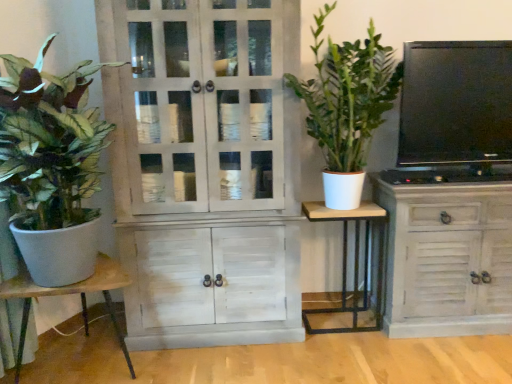
Locate an element on the screen. green matte plant at left, the 1th houseplant from the left is located at coordinates (51, 166).

The height and width of the screenshot is (384, 512). Describe the element at coordinates (354, 262) in the screenshot. I see `white wood table at center, arranged as the 2th table when viewed from the left` at that location.

Based on the photo, measure the distance between point [500,131] and camera.

Point [500,131] and camera are 2.28 meters apart.

At what (x,y) coordinates should I click in order to perform the action: click on distressed white cabinet at right, acting as the first cabinetry starting from the right. Please return your answer as a coordinate pair (x, y). The width and height of the screenshot is (512, 384). Looking at the image, I should click on (447, 251).

Find the location of a particular element. The image size is (512, 384). wooden table at left, which is counted as the 2th table, starting from the right is located at coordinates (70, 294).

Locate an element on the screen. white wood cabinet at center, which is counted as the 2th cabinetry, starting from the right is located at coordinates (205, 168).

Where is `green matte plant at left, the 1th houseplant from the left`? This screenshot has width=512, height=384. green matte plant at left, the 1th houseplant from the left is located at coordinates (51, 166).

How distant is matte black tv at upper right from green matte plant at left, positioned as the second houseplant in right-to-left order?

A distance of 1.69 meters exists between matte black tv at upper right and green matte plant at left, positioned as the second houseplant in right-to-left order.

Is there a large distance between matte black tv at upper right and green matte plant at left, the 1th houseplant from the left?

Yes, matte black tv at upper right is far from green matte plant at left, the 1th houseplant from the left.

From the picture: Can you tell me how much matte black tv at upper right and green matte plant at left, positioned as the second houseplant in right-to-left order, differ in facing direction?

They differ by 36.3 degrees in their facing directions.

In the scene shown: From a real-world perspective, is matte black tv at upper right beneath green matte plant at left, the 1th houseplant from the left?

Actually, matte black tv at upper right is physically above green matte plant at left, the 1th houseplant from the left, in the real world.

The height and width of the screenshot is (384, 512). There is a matte black tv at upper right. Find the location of `the 2nd table below it (from the image's perspective)`. the 2nd table below it (from the image's perspective) is located at coordinates (70, 294).

Is wooden table at left, which is the first table from left to right, outside of matte black tv at upper right?

That's correct, wooden table at left, which is the first table from left to right, is outside of matte black tv at upper right.

Could you tell me if wooden table at left, which is counted as the 2th table, starting from the right, is turned towards matte black tv at upper right?

No, wooden table at left, which is counted as the 2th table, starting from the right, is not oriented towards matte black tv at upper right.

Is the position of wooden table at left, which is the first table from left to right, more distant than that of matte black tv at upper right?

No.

Is point (27, 305) behind point (343, 131)?

No, it is not.

In the scene shown: Is wooden table at left, which is the first table from left to right, not within green matte plant at center, which is counted as the second houseplant, starting from the left?

Result: wooden table at left, which is the first table from left to right, lies outside green matte plant at center, which is counted as the second houseplant, starting from the left,'s area.

How different are the orientations of wooden table at left, which is the first table from left to right, and green matte plant at center, which is counted as the second houseplant, starting from the left, in degrees?

wooden table at left, which is the first table from left to right, and green matte plant at center, which is counted as the second houseplant, starting from the left, are facing 48.7 degrees away from each other.

Identify the location of table that appears in front of the green matte plant at center, which is counted as the second houseplant, starting from the left. Image resolution: width=512 pixels, height=384 pixels. (70, 294).

From the image's perspective, does white wood table at center, which is the 1th table in right-to-left order, appear higher than matte black tv at upper right?

No, from the image's perspective, white wood table at center, which is the 1th table in right-to-left order, is not on top of matte black tv at upper right.

Is white wood table at center, arranged as the 2th table when viewed from the left, positioned far away from matte black tv at upper right?

No, white wood table at center, arranged as the 2th table when viewed from the left, is not far from matte black tv at upper right.

Find the location of a particular element. television above the white wood table at center, arranged as the 2th table when viewed from the left (from the image's perspective) is located at coordinates (456, 102).

From a real-world perspective, is white wood table at center, arranged as the 2th table when viewed from the left, physically located above or below matte black tv at upper right?

white wood table at center, arranged as the 2th table when viewed from the left, is situated lower than matte black tv at upper right in the real world.

From a real-world perspective, which object stands above the other?

green matte plant at center, which is counted as the second houseplant, starting from the left, is physically above.

From the image's perspective, is green matte plant at center, positioned as the first houseplant in right-to-left order, over white wood cabinet at center, which is counted as the 2th cabinetry, starting from the right?

Yes, from the image's perspective, green matte plant at center, positioned as the first houseplant in right-to-left order, is over white wood cabinet at center, which is counted as the 2th cabinetry, starting from the right.

Which is behind, point (335, 69) or point (197, 250)?

The point (335, 69) is farther from the camera.

Would you say green matte plant at center, positioned as the first houseplant in right-to-left order, is outside white wood cabinet at center, which appears as the first cabinetry when viewed from the left?

Absolutely, green matte plant at center, positioned as the first houseplant in right-to-left order, is external to white wood cabinet at center, which appears as the first cabinetry when viewed from the left.

From the image's perspective, relative to white wood cabinet at center, which appears as the first cabinetry when viewed from the left, is distressed white cabinet at right, acting as the first cabinetry starting from the right, above or below?

From the image's perspective, distressed white cabinet at right, acting as the first cabinetry starting from the right, appears below white wood cabinet at center, which appears as the first cabinetry when viewed from the left.

Consider the image. Is distressed white cabinet at right, acting as the first cabinetry starting from the right, at the left side of white wood cabinet at center, which is counted as the 2th cabinetry, starting from the right?

No.

Looking at this image, is distressed white cabinet at right, the 2th cabinetry positioned from the left, beside white wood cabinet at center, which appears as the first cabinetry when viewed from the left?

No, distressed white cabinet at right, the 2th cabinetry positioned from the left, is not with white wood cabinet at center, which appears as the first cabinetry when viewed from the left.

Could you measure the distance between distressed white cabinet at right, acting as the first cabinetry starting from the right, and white wood cabinet at center, which is counted as the 2th cabinetry, starting from the right?

A distance of 36.09 inches exists between distressed white cabinet at right, acting as the first cabinetry starting from the right, and white wood cabinet at center, which is counted as the 2th cabinetry, starting from the right.

Which is farther, (x=378, y=179) or (x=81, y=301)?

The point (x=81, y=301) is behind.

Can you tell me how much distressed white cabinet at right, the 2th cabinetry positioned from the left, and wooden table at left, which is counted as the 2th table, starting from the right, differ in facing direction?

The angle between the facing direction of distressed white cabinet at right, the 2th cabinetry positioned from the left, and the facing direction of wooden table at left, which is counted as the 2th table, starting from the right, is 50.2 degrees.

Identify the location of table that is the 2nd one when counting downward from the distressed white cabinet at right, acting as the first cabinetry starting from the right (from the image's perspective). The image size is (512, 384). (70, 294).

From the matte black tv at upper right, count the 2nd houseplant to the left and point to it. Please provide its 2D coordinates.

[(51, 166)]

From the image's perspective, starting from the matte black tv at upper right, which table is the 2nd one below? Please provide its 2D coordinates.

[(70, 294)]

When comparing their distances from white wood cabinet at center, which appears as the first cabinetry when viewed from the left, does white wood table at center, which is the 1th table in right-to-left order, or distressed white cabinet at right, acting as the first cabinetry starting from the right, seem further?

distressed white cabinet at right, acting as the first cabinetry starting from the right, is further to white wood cabinet at center, which appears as the first cabinetry when viewed from the left.

Considering their positions, is green matte plant at center, which is counted as the second houseplant, starting from the left, positioned closer to white wood cabinet at center, which appears as the first cabinetry when viewed from the left, than distressed white cabinet at right, acting as the first cabinetry starting from the right?

green matte plant at center, which is counted as the second houseplant, starting from the left, lies closer to white wood cabinet at center, which appears as the first cabinetry when viewed from the left, than the other object.

In the scene shown: From the image, which object appears to be farther from distressed white cabinet at right, acting as the first cabinetry starting from the right, white wood table at center, arranged as the 2th table when viewed from the left, or wooden table at left, which is the first table from left to right?

wooden table at left, which is the first table from left to right, lies further to distressed white cabinet at right, acting as the first cabinetry starting from the right, than the other object.

When comparing their distances from matte black tv at upper right, does green matte plant at center, positioned as the first houseplant in right-to-left order, or wooden table at left, which is counted as the 2th table, starting from the right, seem further?

wooden table at left, which is counted as the 2th table, starting from the right, is positioned further to the anchor matte black tv at upper right.

Based on their spatial positions, is wooden table at left, which is the first table from left to right, or white wood table at center, which is the 1th table in right-to-left order, further from matte black tv at upper right?

wooden table at left, which is the first table from left to right, is further to matte black tv at upper right.

When comparing their distances from green matte plant at center, positioned as the first houseplant in right-to-left order, does wooden table at left, which is counted as the 2th table, starting from the right, or matte black tv at upper right seem further?

wooden table at left, which is counted as the 2th table, starting from the right, is further to green matte plant at center, positioned as the first houseplant in right-to-left order.

Based on their spatial positions, is wooden table at left, which is counted as the 2th table, starting from the right, or matte black tv at upper right closer to white wood table at center, arranged as the 2th table when viewed from the left?

The object closer to white wood table at center, arranged as the 2th table when viewed from the left, is matte black tv at upper right.

Consider the image. Based on their spatial positions, is wooden table at left, which is counted as the 2th table, starting from the right, or green matte plant at center, positioned as the first houseplant in right-to-left order, closer to white wood table at center, which is the 1th table in right-to-left order?

The object closer to white wood table at center, which is the 1th table in right-to-left order, is green matte plant at center, positioned as the first houseplant in right-to-left order.

Image resolution: width=512 pixels, height=384 pixels. I want to click on cabinetry between wooden table at left, which is counted as the 2th table, starting from the right, and distressed white cabinet at right, acting as the first cabinetry starting from the right, so click(205, 168).

What are the coordinates of `television situated between green matte plant at left, the 1th houseplant from the left, and distressed white cabinet at right, the 2th cabinetry positioned from the left, from left to right` in the screenshot? It's located at (456, 102).

The height and width of the screenshot is (384, 512). In order to click on cabinetry located between green matte plant at left, positioned as the second houseplant in right-to-left order, and white wood table at center, which is the 1th table in right-to-left order, in the left-right direction in this screenshot , I will do `click(205, 168)`.

Find the location of a particular element. The image size is (512, 384). houseplant situated between green matte plant at left, the 1th houseplant from the left, and distressed white cabinet at right, acting as the first cabinetry starting from the right, from left to right is located at coordinates (347, 106).